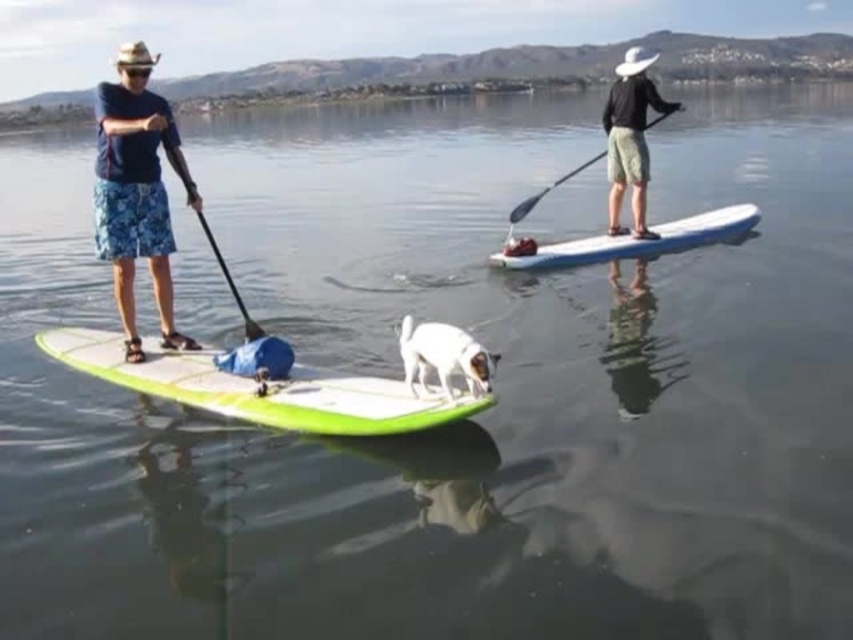
You are a photographer positioned on the shore observing the scene. You want to capture a photo of the blue floral shorts at left and the white glossy paddleboard at center. Based on their positions, which object should you focus on first if you want to include both in the same frame without moving the camera?

The blue floral shorts at left is to the left of the white glossy paddleboard at center, so you should focus on the blue floral shorts at left first to ensure both are in the frame without moving the camera.

You are a photographer positioned at the center of the image. You want to take a photo focusing on the blue floral shorts at left. Which direction should you tilt your camera to capture it?

The blue floral shorts at left is located at point (136, 192), which means it is to the left and slightly below the center of the image. You should tilt your camera to the left and downward to capture it.

You are a photographer trying to capture both the blue floral shorts at left and the white smooth dog at center in a single frame. Based on their sizes, which object should you focus on first to ensure both are in focus?

The blue floral shorts at left is bigger than the white smooth dog at center, so you should focus on the blue floral shorts at left first to ensure both are in focus.